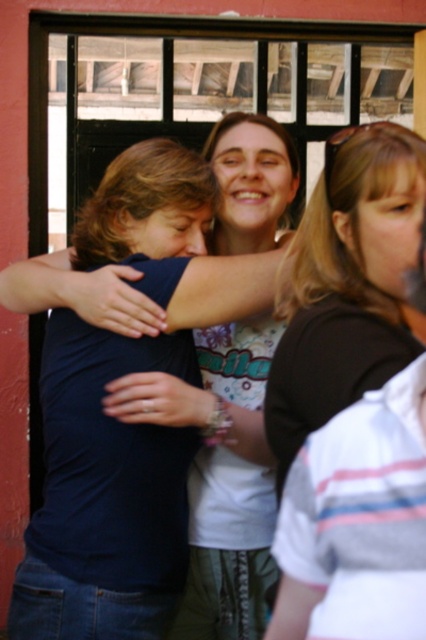
Does matte black shirt at center appear under white striped shirt at right?

Yes, matte black shirt at center is below white striped shirt at right.

Identify the location of matte black shirt at center. This screenshot has height=640, width=426. (229, 484).

Is dark blue shirt at center thinner than matte black shirt at center?

In fact, dark blue shirt at center might be wider than matte black shirt at center.

Between point (144, 164) and point (229, 164), which one is positioned in front?

Point (144, 164) is in front.

Identify the location of dark blue shirt at center. (103, 496).

At what (x,y) coordinates should I click in order to perform the action: click on dark blue shirt at center. Please return your answer as a coordinate pair (x, y). The height and width of the screenshot is (640, 426). Looking at the image, I should click on (103, 496).

Can you confirm if dark blue shirt at center is bigger than white striped shirt at right?

Yes.

Which of these two, dark blue shirt at center or white striped shirt at right, stands taller?

dark blue shirt at center

The height and width of the screenshot is (640, 426). Describe the element at coordinates (103, 496) in the screenshot. I see `dark blue shirt at center` at that location.

Where is `dark blue shirt at center`? This screenshot has height=640, width=426. dark blue shirt at center is located at coordinates (103, 496).